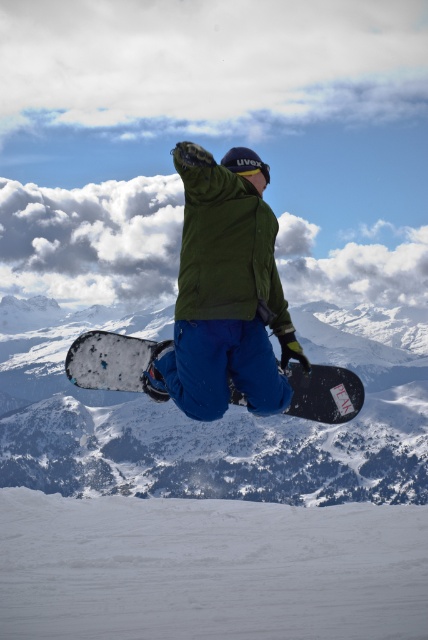
Question: Does white matte snowboard at center have a greater width compared to green matte jacket at center?

Choices:
 (A) yes
 (B) no

Answer: (A)

Question: In this image, where is green matte jacket at center located relative to black matte snowboard at center?

Choices:
 (A) right
 (B) left

Answer: (A)

Question: Which point appears farthest from the camera in this image?

Choices:
 (A) (125, 484)
 (B) (244, 230)

Answer: (A)

Question: Which of the following is the farthest from the observer?

Choices:
 (A) black matte snowboard at center
 (B) white matte snowboard at center
 (C) green matte jacket at center

Answer: (B)

Question: Does green matte jacket at center have a smaller size compared to black matte snowboard at center?

Choices:
 (A) no
 (B) yes

Answer: (B)

Question: Which object is farther from the camera taking this photo?

Choices:
 (A) black matte snowboard at center
 (B) white matte snowboard at center

Answer: (B)